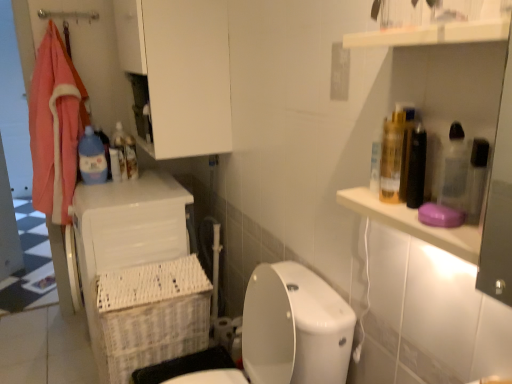
What is the approximate width of blue plastic bottle at left?

3.91 inches.

Describe the element at coordinates (139, 274) in the screenshot. I see `white plastic laundry basket at lower left` at that location.

What do you see at coordinates (223, 331) in the screenshot? Image resolution: width=512 pixels, height=384 pixels. I see `white matte toilet paper at lower center` at bounding box center [223, 331].

You are a GUI agent. You are given a task and a screenshot of the screen. Output one action in this format:
    pyautogui.click(x=<x>, y=<y>)
    Task: Click on the blue plastic bottle at upper left
    
    Given the screenshot: What is the action you would take?
    pyautogui.click(x=118, y=153)

Which is in front, point (192, 78) or point (105, 329)?

Point (105, 329)

Is white matte cabinet at upper center positioned in front of white wicker basket at lower left?

No, the depth of white matte cabinet at upper center is greater than that of white wicker basket at lower left.

Is white wicker basket at lower left at the back of white matte cabinet at upper center?

No, white matte cabinet at upper center is not facing the opposite direction of white wicker basket at lower left.

This screenshot has height=384, width=512. I want to click on basket that appears in front of the blue plastic bottle at left, so click(153, 314).

Considering their positions, is blue plastic bottle at left located in front of or behind white wicker basket at lower left?

Visually, blue plastic bottle at left is located behind white wicker basket at lower left.

Between blue plastic bottle at left and white wicker basket at lower left, which one has larger width?

With larger width is white wicker basket at lower left.

Is white wicker basket at lower left bigger than blue plastic bottle at upper left?

Correct, white wicker basket at lower left is larger in size than blue plastic bottle at upper left.

Is white wicker basket at lower left positioned with its back to blue plastic bottle at upper left?

No, blue plastic bottle at upper left is not at the back of white wicker basket at lower left.

Can you tell me how much white wicker basket at lower left and blue plastic bottle at upper left differ in facing direction?

72.5 degrees separate the facing orientations of white wicker basket at lower left and blue plastic bottle at upper left.

There is a white wicker basket at lower left. In order to click on bottle above it (from a real-world perspective) in this screenshot , I will do `click(118, 153)`.

Is white glossy toilet at lower center wider or thinner than white wicker basket at lower left?

white glossy toilet at lower center is wider than white wicker basket at lower left.

Could you tell me if white glossy toilet at lower center is facing white wicker basket at lower left?

No.

Can we say white wicker basket at lower left lies outside white matte cabinet at upper center?

Yes, white wicker basket at lower left is not within white matte cabinet at upper center.

Is the depth of white wicker basket at lower left less than that of white matte cabinet at upper center?

Yes, white wicker basket at lower left is closer to the viewer.

From a real-world perspective, does white wicker basket at lower left sit lower than white matte cabinet at upper center?

Yes, from a real-world perspective, white wicker basket at lower left is beneath white matte cabinet at upper center.

Which is more to the right, white plastic laundry basket at lower left or white glossy toilet at lower center?

white glossy toilet at lower center is more to the right.

Looking at this image, from the image's perspective, would you say white plastic laundry basket at lower left is shown under white glossy toilet at lower center?

Incorrect, from the image's perspective, white plastic laundry basket at lower left is higher than white glossy toilet at lower center.

In terms of height, does white plastic laundry basket at lower left look taller or shorter compared to white glossy toilet at lower center?

In the image, white plastic laundry basket at lower left appears to be taller than white glossy toilet at lower center.

Which is correct: white plastic laundry basket at lower left is inside white glossy toilet at lower center, or outside of it?

white plastic laundry basket at lower left lies outside white glossy toilet at lower center.

Looking at the image, does white glossy toilet at lower center seem bigger or smaller compared to white matte cabinet at upper center?

Considering their sizes, white glossy toilet at lower center takes up more space than white matte cabinet at upper center.

From the image's perspective, is white glossy toilet at lower center located above white matte cabinet at upper center?

Incorrect, from the image's perspective, white glossy toilet at lower center is lower than white matte cabinet at upper center.

Is white matte cabinet at upper center inside white glossy toilet at lower center?

Actually, white matte cabinet at upper center is outside white glossy toilet at lower center.

This screenshot has height=384, width=512. Find the location of `cabinetry that appears on the right of white wicker basket at lower left`. cabinetry that appears on the right of white wicker basket at lower left is located at coordinates (180, 71).

Image resolution: width=512 pixels, height=384 pixels. In order to click on cleaning product above the white wicker basket at lower left (from the image's perspective) in this screenshot , I will do `click(92, 158)`.

When comparing their distances from white matte toilet paper at lower center, does white plastic laundry basket at lower left or white wicker basket at lower left seem closer?

The object closer to white matte toilet paper at lower center is white wicker basket at lower left.

Looking at the image, which one is located further to blue plastic bottle at upper left, white matte cabinet at upper center or white wicker basket at lower left?

white wicker basket at lower left is further to blue plastic bottle at upper left.

Looking at the image, which one is located further to white glossy toilet at lower center, white matte toilet paper at lower center or blue plastic bottle at left?

Based on the image, blue plastic bottle at left appears to be further to white glossy toilet at lower center.

Looking at this image, considering their positions, is white matte cabinet at upper center positioned closer to white plastic laundry basket at lower left than white matte toilet paper at lower center?

white matte toilet paper at lower center.

Considering their positions, is white plastic laundry basket at lower left positioned further to white wicker basket at lower left than blue plastic bottle at left?

blue plastic bottle at left.

Considering their positions, is white glossy toilet at lower center positioned further to blue plastic bottle at left than white wicker basket at lower left?

white glossy toilet at lower center.

Which object lies nearer to the anchor point white wicker basket at lower left, blue plastic bottle at left or white glossy toilet at lower center?

Among the two, white glossy toilet at lower center is located nearer to white wicker basket at lower left.

Looking at the image, which one is located closer to white wicker basket at lower left, white matte toilet paper at lower center or white plastic laundry basket at lower left?

The object closer to white wicker basket at lower left is white plastic laundry basket at lower left.

The height and width of the screenshot is (384, 512). I want to click on cleaning product between white matte cabinet at upper center and white wicker basket at lower left in the up-down direction, so click(92, 158).

Find the location of a particular element. The image size is (512, 384). appliance between blue plastic bottle at upper left and white matte toilet paper at lower center vertically is located at coordinates (139, 274).

The image size is (512, 384). Identify the location of basket between white matte cabinet at upper center and white matte toilet paper at lower center in the vertical direction. (153, 314).

The width and height of the screenshot is (512, 384). I want to click on appliance between white glossy toilet at lower center and blue plastic bottle at left in the front-back direction, so click(x=139, y=274).